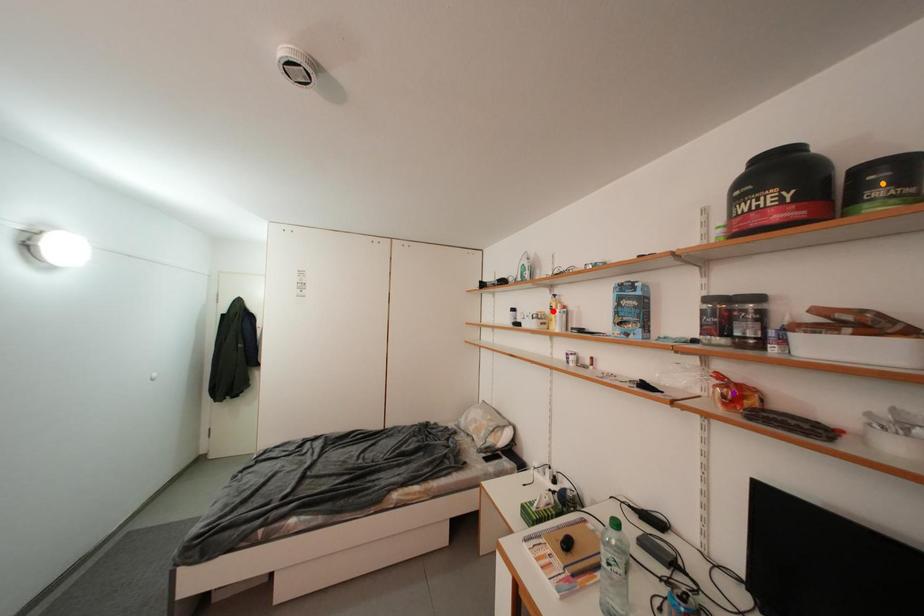
Order these from farthest to nearest:
A) red point
B) orange point
C) purple point

1. red point
2. purple point
3. orange point